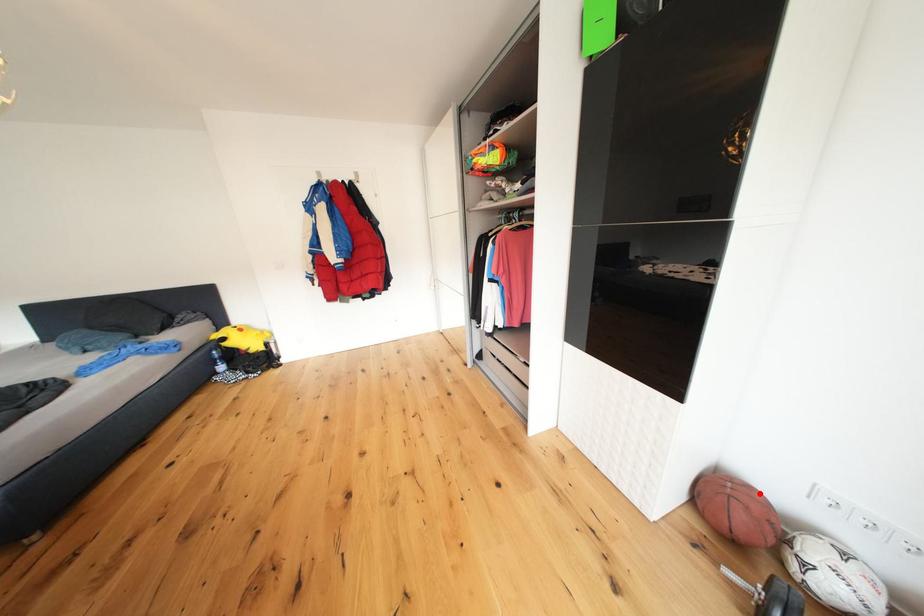
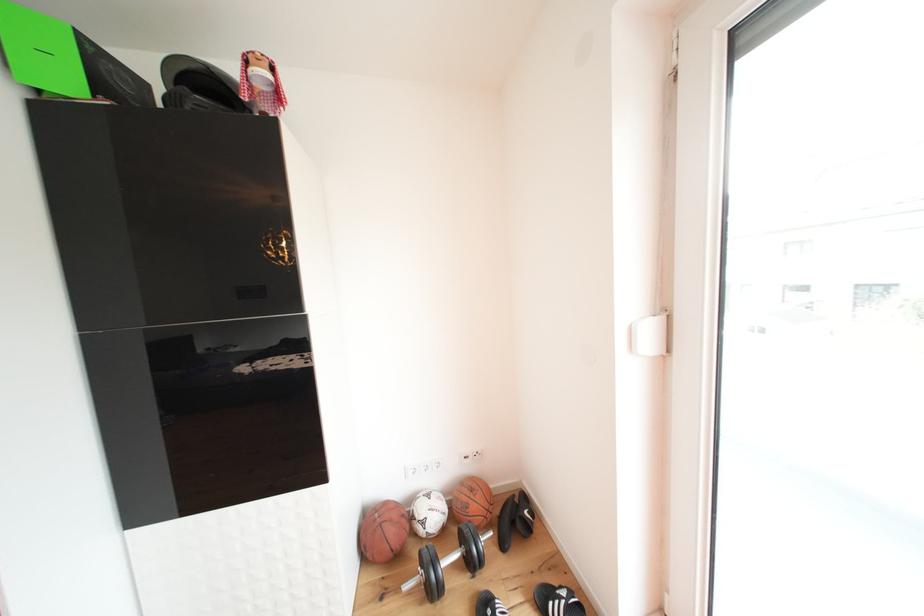
Question: I am providing you with two images of the same scene from different viewpoints. A red point is marked on the first image. Can you still see the location of the red point in image 2?

Choices:
 (A) Yes
 (B) No

Answer: (A)